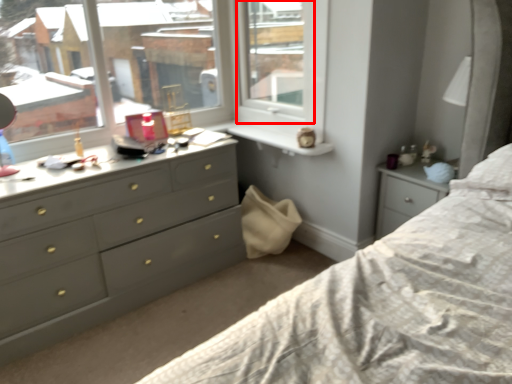
Question: From the image's perspective, what is the correct spatial relationship of window frame (annotated by the red box) in relation to chest of drawers?

Choices:
 (A) above
 (B) below

Answer: (A)